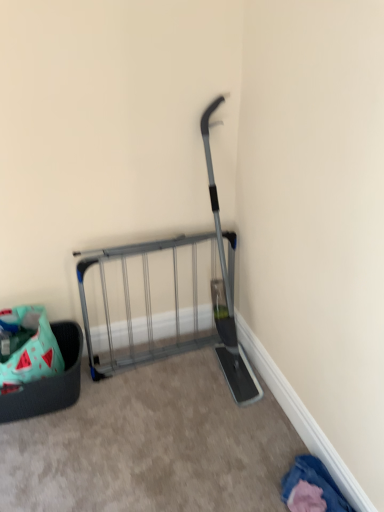
Question: Would you consider denim fabric pants at lower right to be distant from mint fabric basket at lower left?

Choices:
 (A) no
 (B) yes

Answer: (B)

Question: Does denim fabric pants at lower right touch mint fabric basket at lower left?

Choices:
 (A) no
 (B) yes

Answer: (A)

Question: Is denim fabric pants at lower right smaller than mint fabric basket at lower left?

Choices:
 (A) yes
 (B) no

Answer: (A)

Question: Does denim fabric pants at lower right have a greater height compared to mint fabric basket at lower left?

Choices:
 (A) no
 (B) yes

Answer: (A)

Question: Does denim fabric pants at lower right have a larger size compared to mint fabric basket at lower left?

Choices:
 (A) yes
 (B) no

Answer: (B)

Question: Is denim fabric pants at lower right positioned behind mint fabric basket at lower left?

Choices:
 (A) no
 (B) yes

Answer: (A)

Question: From a real-world perspective, is mint fabric basket at lower left beneath silver metallic gate at center?

Choices:
 (A) yes
 (B) no

Answer: (A)

Question: Can you confirm if mint fabric basket at lower left is positioned to the right of silver metallic gate at center?

Choices:
 (A) yes
 (B) no

Answer: (B)

Question: Is mint fabric basket at lower left thinner than silver metallic gate at center?

Choices:
 (A) yes
 (B) no

Answer: (B)

Question: From the image's perspective, would you say mint fabric basket at lower left is shown under silver metallic gate at center?

Choices:
 (A) yes
 (B) no

Answer: (A)

Question: Is the surface of mint fabric basket at lower left in direct contact with silver metallic gate at center?

Choices:
 (A) yes
 (B) no

Answer: (B)

Question: From a real-world perspective, is mint fabric basket at lower left on top of silver metallic gate at center?

Choices:
 (A) yes
 (B) no

Answer: (B)

Question: From a real-world perspective, is denim fabric pants at lower right positioned over silver metallic gate at center based on gravity?

Choices:
 (A) no
 (B) yes

Answer: (A)